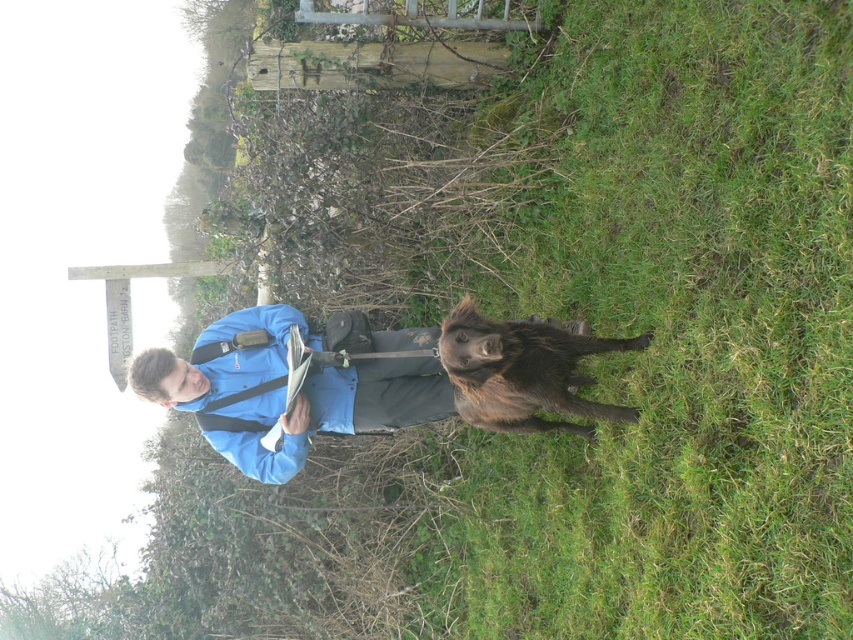
Question: Is green grass at center to the left of blue fabric jacket at center from the viewer's perspective?

Choices:
 (A) no
 (B) yes

Answer: (A)

Question: Is green grass at center thinner than brown furry dog at center?

Choices:
 (A) no
 (B) yes

Answer: (A)

Question: Is green grass at center above blue fabric jacket at center?

Choices:
 (A) yes
 (B) no

Answer: (A)

Question: Which of the following is the closest to the observer?

Choices:
 (A) (288, 416)
 (B) (804, 320)

Answer: (B)

Question: Which point appears closest to the camera in this image?

Choices:
 (A) (525, 410)
 (B) (407, 337)
 (C) (508, 500)

Answer: (A)

Question: Which object appears closest to the camera in this image?

Choices:
 (A) brown furry dog at center
 (B) blue fabric jacket at center

Answer: (A)